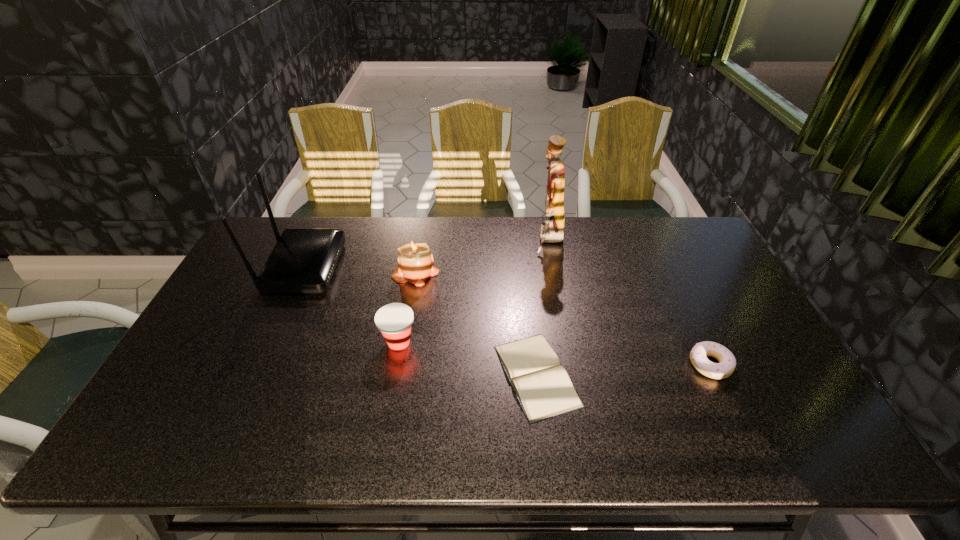
Locate an element on the screen. blank space located on the front-facing side of the tallest object is located at coordinates (446, 241).

Find the location of a particular element. Image resolution: width=960 pixels, height=540 pixels. vacant space situated 0.240m on the front-facing side of the router is located at coordinates (412, 266).

Find the location of `blank space located 0.110m on the front of the fourth shortest object`. blank space located 0.110m on the front of the fourth shortest object is located at coordinates (409, 312).

The width and height of the screenshot is (960, 540). I want to click on free space located 0.280m on the left of the third shortest object, so click(278, 342).

Identify the location of vacant space positioned 0.170m on the left of the fifth tallest object. (625, 364).

Locate an element on the screen. free location located on the left of the Bible is located at coordinates (424, 375).

Locate an element on the screen. This screenshot has width=960, height=540. nutcracker that is at the far edge is located at coordinates (551, 231).

Identify the location of router that is at the far edge. This screenshot has width=960, height=540. (303, 260).

Where is `object at the near edge`? object at the near edge is located at coordinates (542, 386).

Find the location of a particular element. object that is at the left edge is located at coordinates (303, 260).